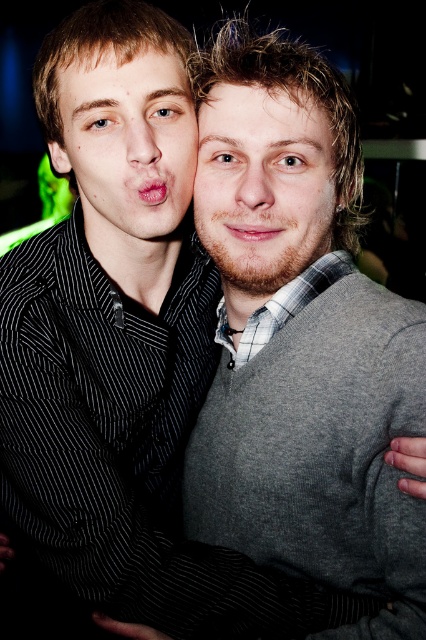
Question: Among these points, which one is farthest from the camera?

Choices:
 (A) (252, 196)
 (B) (206, 164)
 (C) (152, 136)

Answer: (B)

Question: Is smooth gray sweater at center in front of matte pink lips at center?

Choices:
 (A) no
 (B) yes

Answer: (B)

Question: Which object is the closest to the smooth gray sweater at center?

Choices:
 (A) smooth skin nose at center
 (B) matte black shirt at left

Answer: (A)

Question: Estimate the real-world distances between objects in this image. Which object is farther from the matte black shirt at left?

Choices:
 (A) matte skin nose at center
 (B) brown matte beard at center
 (C) smooth skin nose at center
 (D) matte pink lips at center

Answer: (C)

Question: Where is brown matte beard at center located in relation to matte skin nose at center in the image?

Choices:
 (A) below
 (B) above

Answer: (A)

Question: Can you confirm if matte black shirt at left is positioned above matte pink lips at center?

Choices:
 (A) yes
 (B) no

Answer: (A)